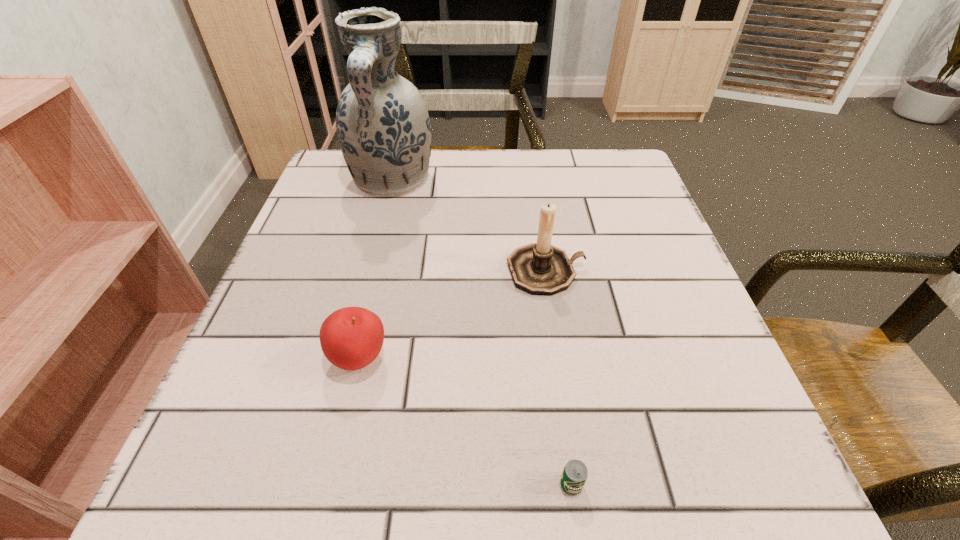
This screenshot has height=540, width=960. In order to click on free location that satisfies the following two spatial constraints: 1. on the back side of the third shortest object; 2. on the right side of the third tallest object in this screenshot , I will do pyautogui.click(x=379, y=271).

Identify the location of free spot that satisfies the following two spatial constraints: 1. with the handle on the side of the farthest object; 2. on the left side of the nearest object. This screenshot has width=960, height=540. (315, 485).

Locate an element on the screen. The height and width of the screenshot is (540, 960). free spot that satisfies the following two spatial constraints: 1. on the front side of the apple; 2. on the right side of the beer can is located at coordinates (330, 485).

Where is `free space that satisfies the following two spatial constraints: 1. with the handle on the side of the third nearest object; 2. on the right side of the tallest object`? free space that satisfies the following two spatial constraints: 1. with the handle on the side of the third nearest object; 2. on the right side of the tallest object is located at coordinates (370, 271).